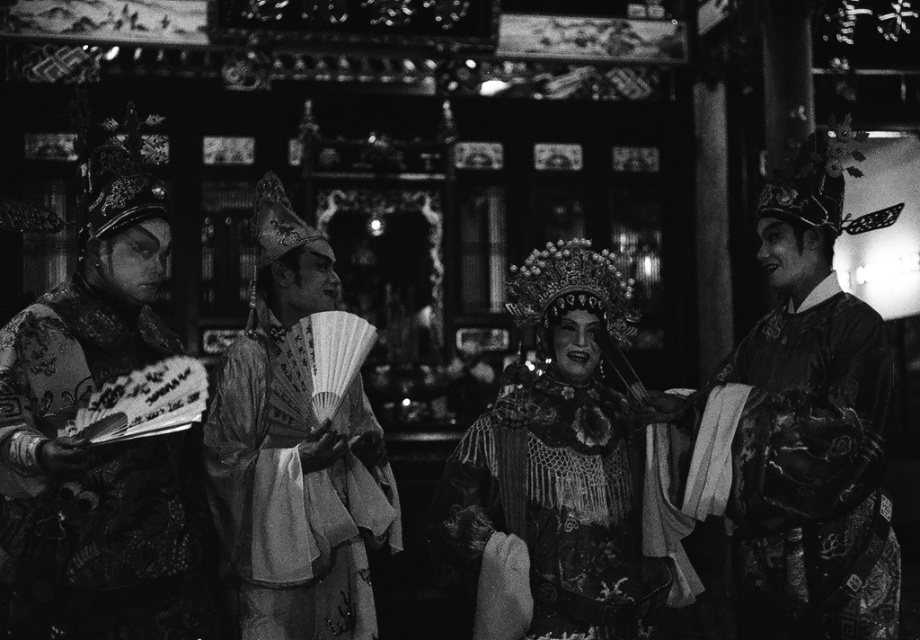
Which is more to the right, silky black robe at right or silky white robe at center?

silky black robe at right

Who is more forward, (820, 182) or (265, 205)?

Point (820, 182)

Is point (814, 328) farther from camera compared to point (311, 500)?

Yes, point (814, 328) is farther from viewer.

Identify the location of silky black robe at right. (811, 429).

Is matte black fan at left shorter than matte ornate headdress at center?

In fact, matte black fan at left may be taller than matte ornate headdress at center.

Is matte black fan at left closer to camera compared to matte ornate headdress at center?

Yes.

Is point (47, 401) positioned behind point (571, 492)?

No.

I want to click on matte black fan at left, so click(101, 445).

Is point (152, 208) positioned in front of point (719, 387)?

Yes, point (152, 208) is in front of point (719, 387).

Is matte black fan at left shorter than silky black robe at right?

Correct, matte black fan at left is not as tall as silky black robe at right.

The width and height of the screenshot is (920, 640). Identify the location of matte black fan at left. (101, 445).

Find the location of a particular element. Image resolution: width=920 pixels, height=640 pixels. matte black fan at left is located at coordinates (101, 445).